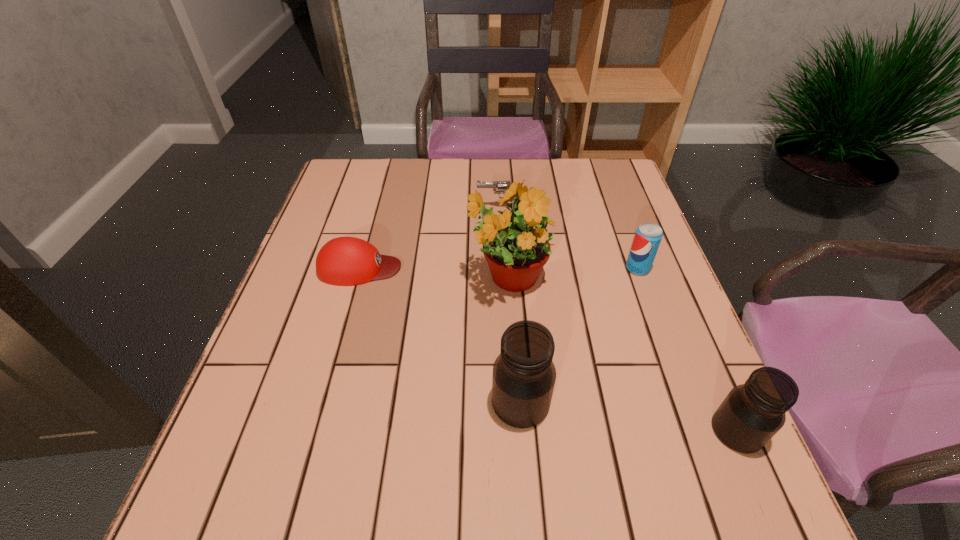
In the current image, all jars are evenly spaced. To maintain this equal spacing, where should an additional jar be placed on the left? Please point out a free spot. Please provide its 2D coordinates. Your answer should be formatted as a tuple, i.e. [(x, y)], where the tuple contains the x and y coordinates of a point satisfying the conditions above.

[(324, 376)]